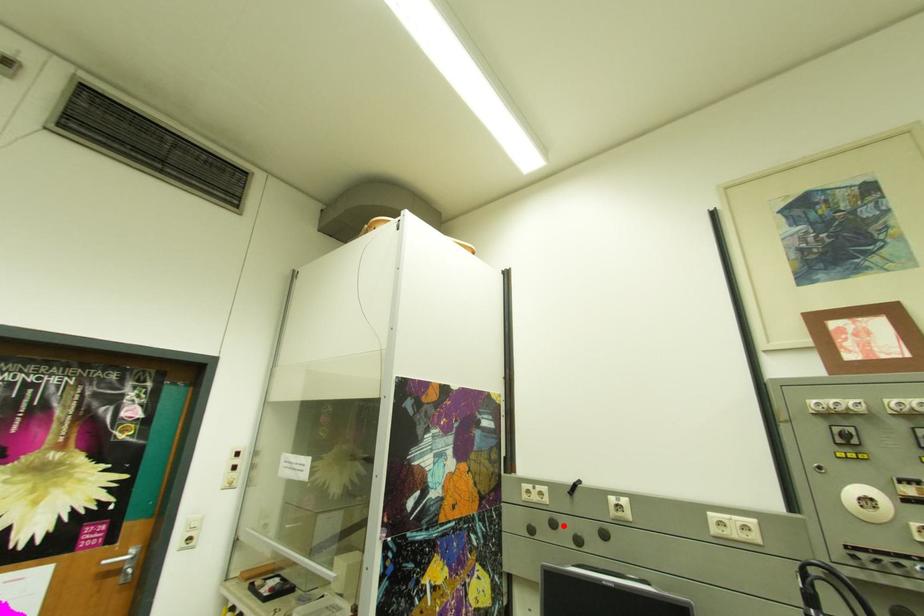
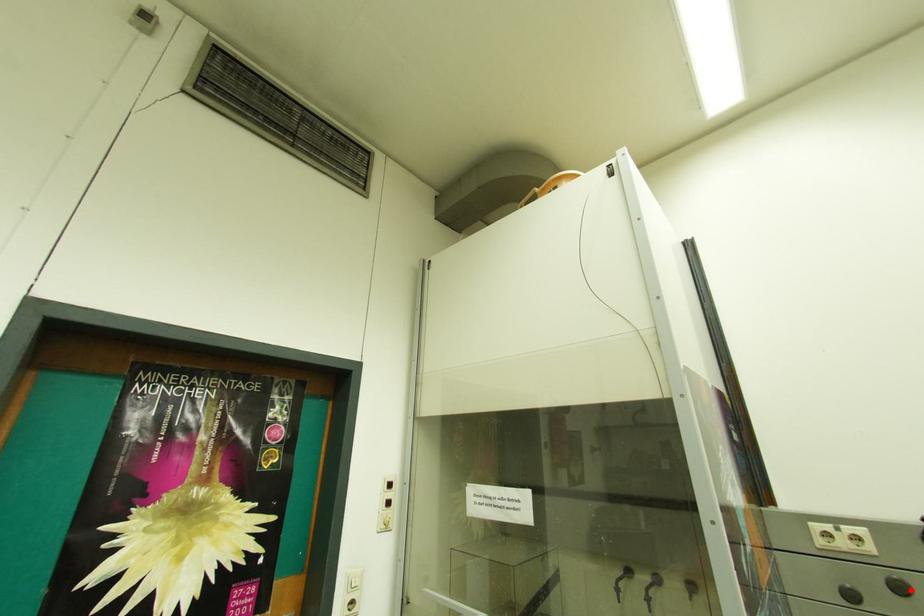
I am providing you with two images of the same scene from different viewpoints. A red point is marked on the first image and another point is marked on the second image. Is the red point in image1 aligned with the point shown in image2?

Yes